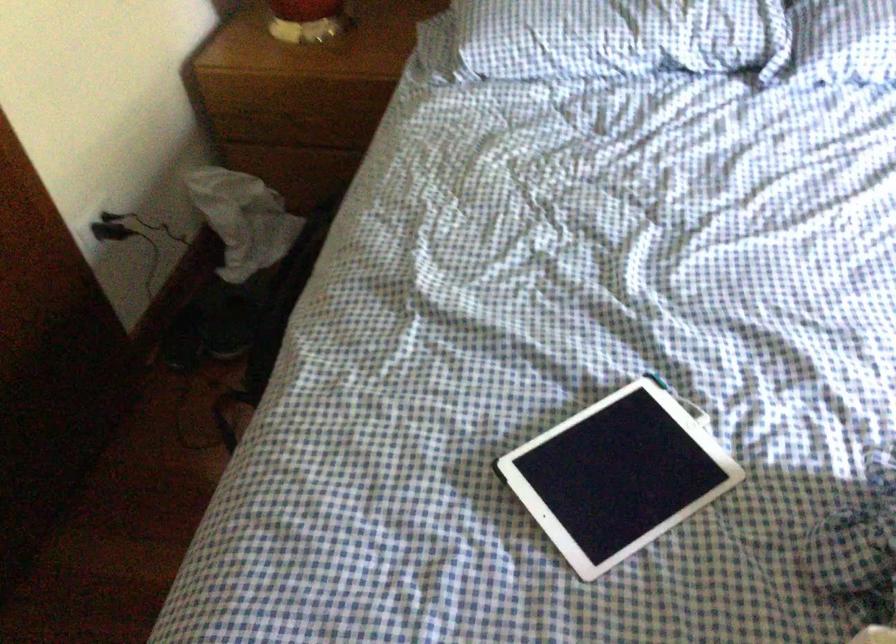
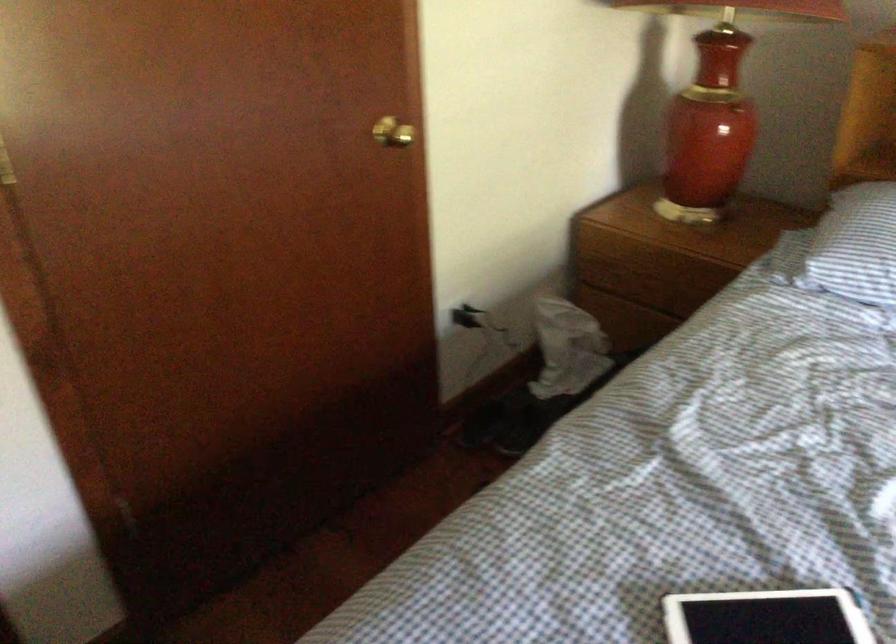
Where in the second image is the point corresponding to (300,122) from the first image?

(650, 283)